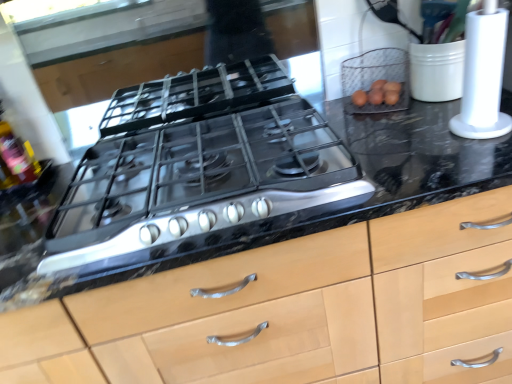
Question: From a real-world perspective, is white plastic paper towel holder at right physically above translucent plastic bottle at left?

Choices:
 (A) no
 (B) yes

Answer: (A)

Question: Does white plastic paper towel holder at right touch translucent plastic bottle at left?

Choices:
 (A) yes
 (B) no

Answer: (B)

Question: Would you consider white plastic paper towel holder at right to be distant from translucent plastic bottle at left?

Choices:
 (A) no
 (B) yes

Answer: (B)

Question: From the image's perspective, is white plastic paper towel holder at right below translucent plastic bottle at left?

Choices:
 (A) no
 (B) yes

Answer: (A)

Question: Does white plastic paper towel holder at right have a larger size compared to translucent plastic bottle at left?

Choices:
 (A) no
 (B) yes

Answer: (B)

Question: Looking at the image, does wire mesh basket at upper right seem bigger or smaller compared to white plastic paper towel holder at right?

Choices:
 (A) big
 (B) small

Answer: (B)

Question: Considering their positions, is wire mesh basket at upper right located in front of or behind white plastic paper towel holder at right?

Choices:
 (A) front
 (B) behind

Answer: (B)

Question: From a real-world perspective, relative to white plastic paper towel holder at right, is wire mesh basket at upper right vertically above or below?

Choices:
 (A) below
 (B) above

Answer: (A)

Question: Is wire mesh basket at upper right spatially inside white plastic paper towel holder at right, or outside of it?

Choices:
 (A) outside
 (B) inside

Answer: (A)

Question: In the image, is black marble countertop at center on the left side or the right side of translucent plastic bottle at left?

Choices:
 (A) left
 (B) right

Answer: (B)

Question: In terms of size, does black marble countertop at center appear bigger or smaller than translucent plastic bottle at left?

Choices:
 (A) big
 (B) small

Answer: (A)

Question: From the image's perspective, is black marble countertop at center above or below translucent plastic bottle at left?

Choices:
 (A) below
 (B) above

Answer: (A)

Question: From a real-world perspective, is black marble countertop at center physically located above or below translucent plastic bottle at left?

Choices:
 (A) below
 (B) above

Answer: (A)

Question: Is point (0, 187) positioned closer to the camera than point (479, 61)?

Choices:
 (A) farther
 (B) closer

Answer: (A)

Question: From a real-world perspective, is translucent plastic bottle at left above or below white plastic paper towel holder at right?

Choices:
 (A) above
 (B) below

Answer: (A)